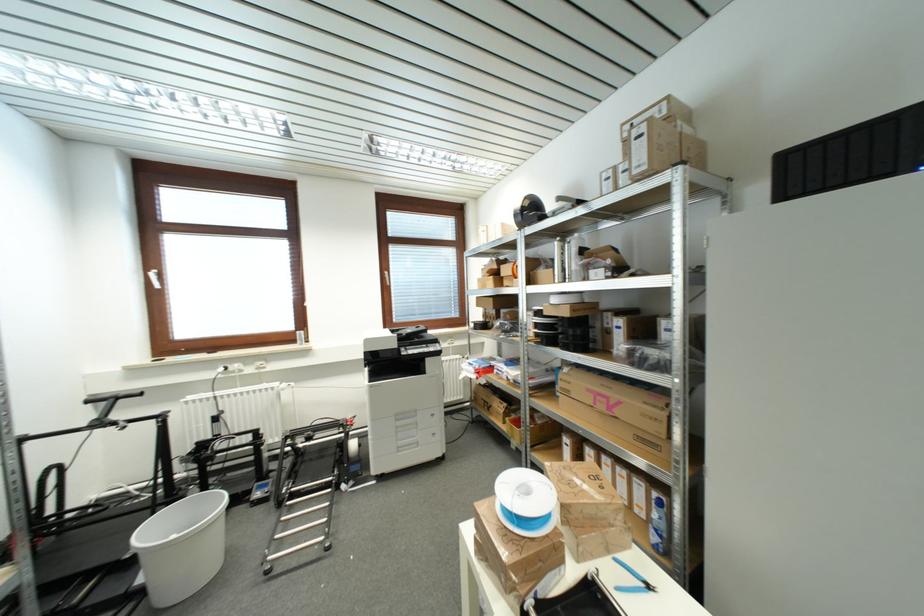
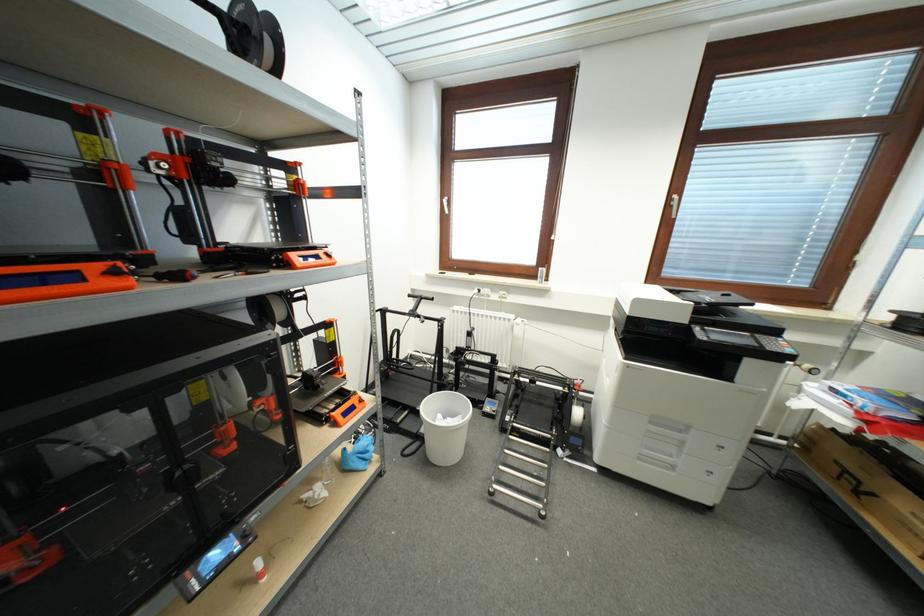
Based on the continuous images, in which direction is the camera rotating?

The camera rotated toward left-down.